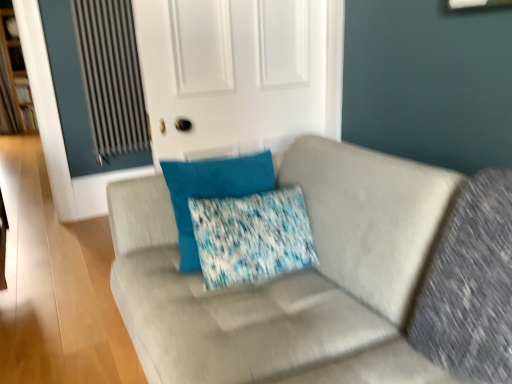
Question: Is white matte door at upper center outside suede gray couch at center?

Choices:
 (A) yes
 (B) no

Answer: (A)

Question: Considering the relative sizes of white matte door at upper center and suede gray couch at center in the image provided, is white matte door at upper center shorter than suede gray couch at center?

Choices:
 (A) no
 (B) yes

Answer: (B)

Question: Is white matte door at upper center at the right side of suede gray couch at center?

Choices:
 (A) no
 (B) yes

Answer: (A)

Question: Considering the relative positions of white matte door at upper center and suede gray couch at center in the image provided, is white matte door at upper center in front of suede gray couch at center?

Choices:
 (A) yes
 (B) no

Answer: (B)

Question: From the image's perspective, is white matte door at upper center located beneath suede gray couch at center?

Choices:
 (A) yes
 (B) no

Answer: (B)

Question: Considering the positions of point (169, 173) and point (72, 6), is point (169, 173) closer or farther from the camera than point (72, 6)?

Choices:
 (A) farther
 (B) closer

Answer: (B)

Question: From their relative heights in the image, would you say blue fabric pillow at center is taller or shorter than metallic ribbed radiator at upper left?

Choices:
 (A) short
 (B) tall

Answer: (A)

Question: Is blue fabric pillow at center spatially inside metallic ribbed radiator at upper left, or outside of it?

Choices:
 (A) inside
 (B) outside

Answer: (B)

Question: Would you say blue fabric pillow at center is to the left or to the right of metallic ribbed radiator at upper left in the picture?

Choices:
 (A) right
 (B) left

Answer: (A)

Question: Looking at the image, does white matte door at upper center seem bigger or smaller compared to blue textured pillow at center?

Choices:
 (A) big
 (B) small

Answer: (A)

Question: From their relative heights in the image, would you say white matte door at upper center is taller or shorter than blue textured pillow at center?

Choices:
 (A) tall
 (B) short

Answer: (A)

Question: Does point (292, 82) appear closer or farther from the camera than point (254, 271)?

Choices:
 (A) farther
 (B) closer

Answer: (A)

Question: From the image's perspective, relative to blue textured pillow at center, is white matte door at upper center above or below?

Choices:
 (A) below
 (B) above

Answer: (B)

Question: From a real-world perspective, is suede gray couch at center above or below blue textured pillow at center?

Choices:
 (A) above
 (B) below

Answer: (B)

Question: Would you say suede gray couch at center is to the left or to the right of blue textured pillow at center in the picture?

Choices:
 (A) right
 (B) left

Answer: (A)